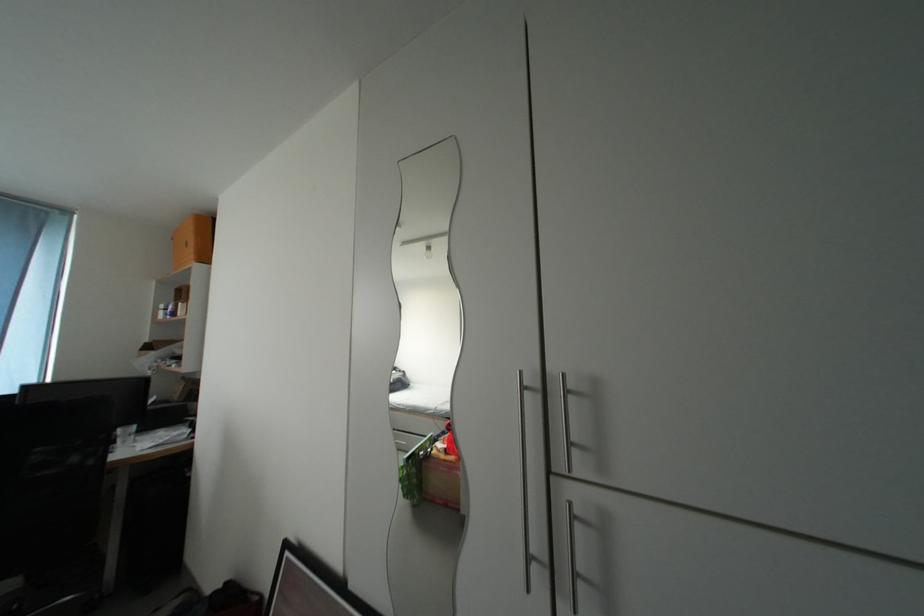
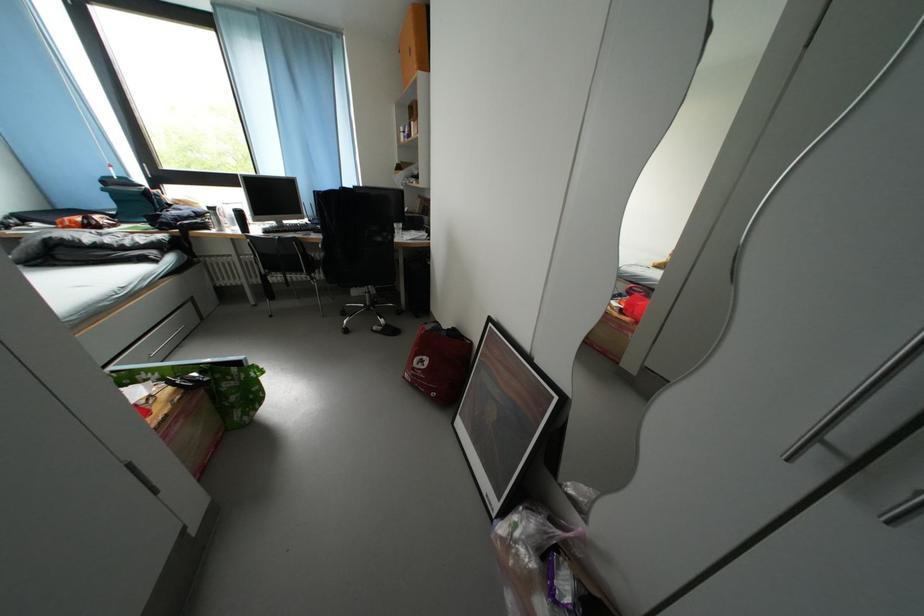
The point at (x=295, y=549) is marked in the first image. Where is the corresponding point in the second image?

(497, 325)